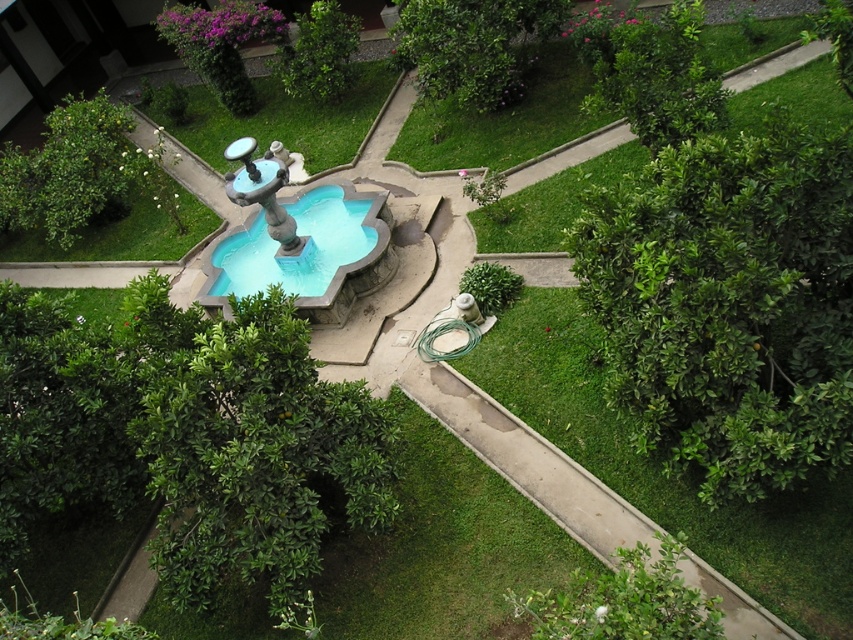
You are designing a garden layout and want to place a new statue between the green leafy tree at upper right and the green leafy bush at upper center. Based on their sizes, which object should the statue be closer to?

The green leafy tree at upper right is smaller than the green leafy bush at upper center, so the statue should be closer to the green leafy tree at upper right to balance the sizes.

You are standing at the edge of the garden and want to take a photo of the green leafy tree at lower left and the green leafy tree at upper center. Which tree will appear closer to the camera in the photo?

The green leafy tree at lower left will appear closer to the camera because it is positioned in front of the green leafy tree at upper center.

You are planning to place a small garden bench between the green leafy tree at upper right and the green leafy bush at upper center. Considering their widths, which one should you place the bench closer to for better spacing?

The green leafy tree at upper right is narrower than the green leafy bush at upper center, so you should place the bench closer to the green leafy tree at upper right to ensure balanced spacing between them.